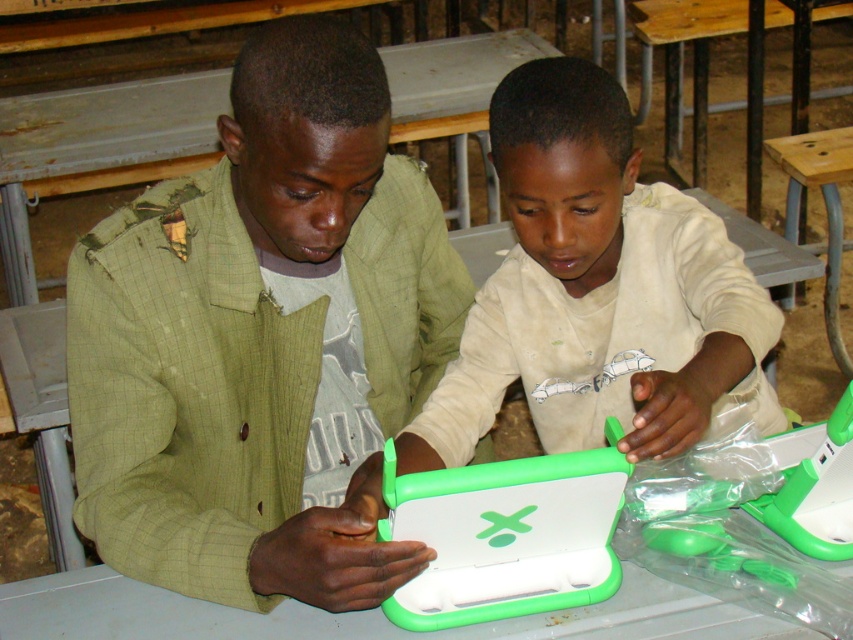
Question: Observing the image, what is the correct spatial positioning of green matte laptop at center in reference to matte green tablet at center?

Choices:
 (A) left
 (B) right

Answer: (A)

Question: Which object appears farthest from the camera in this image?

Choices:
 (A) green matte laptop at center
 (B) matte green tablet at center

Answer: (A)

Question: Which of the following is the farthest from the observer?

Choices:
 (A) green matte laptop at center
 (B) matte green tablet at center

Answer: (A)

Question: Is the position of green matte laptop at center more distant than that of matte green tablet at center?

Choices:
 (A) yes
 (B) no

Answer: (A)

Question: Which point is closer to the camera taking this photo?

Choices:
 (A) (566, 173)
 (B) (450, 301)

Answer: (A)

Question: Can you confirm if green matte laptop at center is thinner than matte green tablet at center?

Choices:
 (A) no
 (B) yes

Answer: (B)